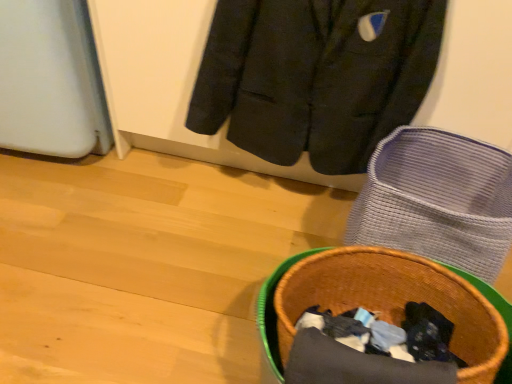
Question: Considering the positions of brown woven basket at lower right and woven fabric basket at lower right in the image, is brown woven basket at lower right bigger or smaller than woven fabric basket at lower right?

Choices:
 (A) small
 (B) big

Answer: (B)

Question: In terms of width, does brown woven basket at lower right look wider or thinner when compared to woven fabric basket at lower right?

Choices:
 (A) wide
 (B) thin

Answer: (A)

Question: Which object is the closest to the brown woven basket at lower right?

Choices:
 (A) dark gray wool jacket at upper center
 (B) woven fabric basket at lower right

Answer: (B)

Question: Estimate the real-world distances between objects in this image. Which object is closer to the brown woven basket at lower right?

Choices:
 (A) dark gray wool jacket at upper center
 (B) woven fabric basket at lower right

Answer: (B)